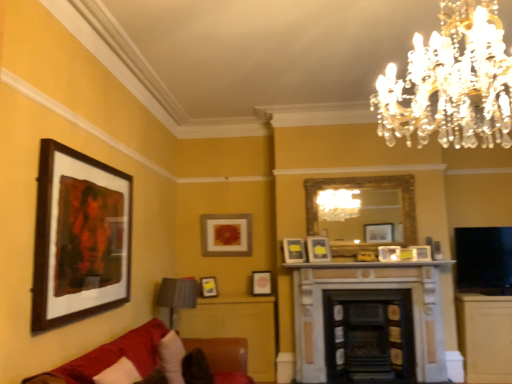
Question: Is matte white picture frame at center, placed as the 5th picture frame when sorted from left to right, further to the viewer compared to matte yellow picture frame at center, which is counted as the seventh picture frame, starting from the right?

Choices:
 (A) no
 (B) yes

Answer: (A)

Question: Can you confirm if matte white picture frame at center, marked as the 4th picture frame in a right-to-left arrangement, is wider than matte yellow picture frame at center, placed as the 2th picture frame when sorted from left to right?

Choices:
 (A) no
 (B) yes

Answer: (A)

Question: Does matte white picture frame at center, which appears as the fourth picture frame when viewed from the back, have a lesser width compared to matte yellow picture frame at center, which is counted as the seventh picture frame, starting from the right?

Choices:
 (A) yes
 (B) no

Answer: (A)

Question: From a real-world perspective, is matte white picture frame at center, marked as the 4th picture frame in a right-to-left arrangement, under matte yellow picture frame at center, which is counted as the 3th picture frame, starting from the back?

Choices:
 (A) yes
 (B) no

Answer: (B)

Question: Can you confirm if matte white picture frame at center, which appears as the fourth picture frame when viewed from the back, is positioned to the right of matte yellow picture frame at center, placed as the 2th picture frame when sorted from left to right?

Choices:
 (A) no
 (B) yes

Answer: (B)

Question: Considering the relative sizes of matte white picture frame at center, acting as the fifth picture frame starting from the front, and matte yellow picture frame at center, placed as the 2th picture frame when sorted from left to right, in the image provided, is matte white picture frame at center, acting as the fifth picture frame starting from the front, shorter than matte yellow picture frame at center, placed as the 2th picture frame when sorted from left to right,?

Choices:
 (A) yes
 (B) no

Answer: (B)

Question: Can you confirm if matte gold picture frame at center, which appears as the 8th picture frame when viewed from the front, is smaller than matte yellow picture frame at center, positioned as the sixth picture frame in back-to-front order?

Choices:
 (A) no
 (B) yes

Answer: (A)

Question: From a real-world perspective, is matte gold picture frame at center, which appears as the 8th picture frame when viewed from the front, physically above matte yellow picture frame at center, arranged as the third picture frame when viewed from the right?

Choices:
 (A) no
 (B) yes

Answer: (B)

Question: Is matte gold picture frame at center, which appears as the 8th picture frame when viewed from the front, at the left side of matte yellow picture frame at center, positioned as the sixth picture frame in back-to-front order?

Choices:
 (A) yes
 (B) no

Answer: (A)

Question: Can you confirm if matte gold picture frame at center, the third picture frame viewed from the left, is wider than matte yellow picture frame at center, arranged as the third picture frame when viewed from the right?

Choices:
 (A) yes
 (B) no

Answer: (A)

Question: From a real-world perspective, is matte gold picture frame at center, positioned as the sixth picture frame in right-to-left order, physically below matte yellow picture frame at center, positioned as the sixth picture frame in back-to-front order?

Choices:
 (A) yes
 (B) no

Answer: (B)

Question: Is matte gold picture frame at center, which appears as the 8th picture frame when viewed from the front, facing towards matte yellow picture frame at center, arranged as the third picture frame when viewed from the right?

Choices:
 (A) yes
 (B) no

Answer: (B)

Question: Can you confirm if velvet red couch at lower left is positioned to the left of matte gold picture frame at center, the third picture frame viewed from the left?

Choices:
 (A) yes
 (B) no

Answer: (A)